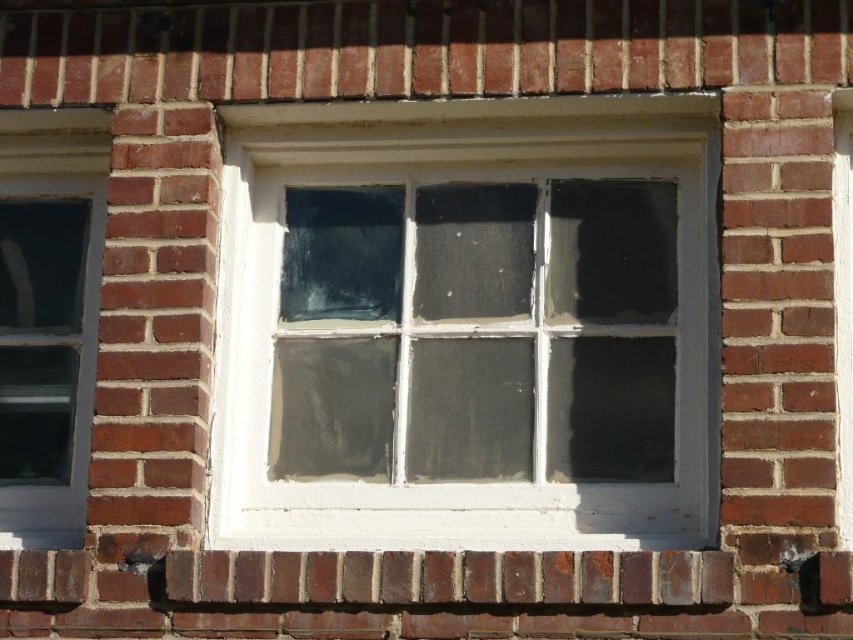
You are standing in front of a brick wall with a window. You want to locate the white painted wood window frame at center. Where should you look?

The white painted wood window frame at center is located at point (467,324).

You are standing in front of a brick wall with two windows. You notice a point marked at coordinates (467, 324). What object does this point correspond to?

The point at coordinates (467, 324) corresponds to the white painted wood window frame at center.

You are standing in front of a brick wall with two windows. You see a white painted wood window frame at center and a clear glass window at left. Which window is positioned to the right side of the other?

The white painted wood window frame at center is positioned to the right of the clear glass window at left.